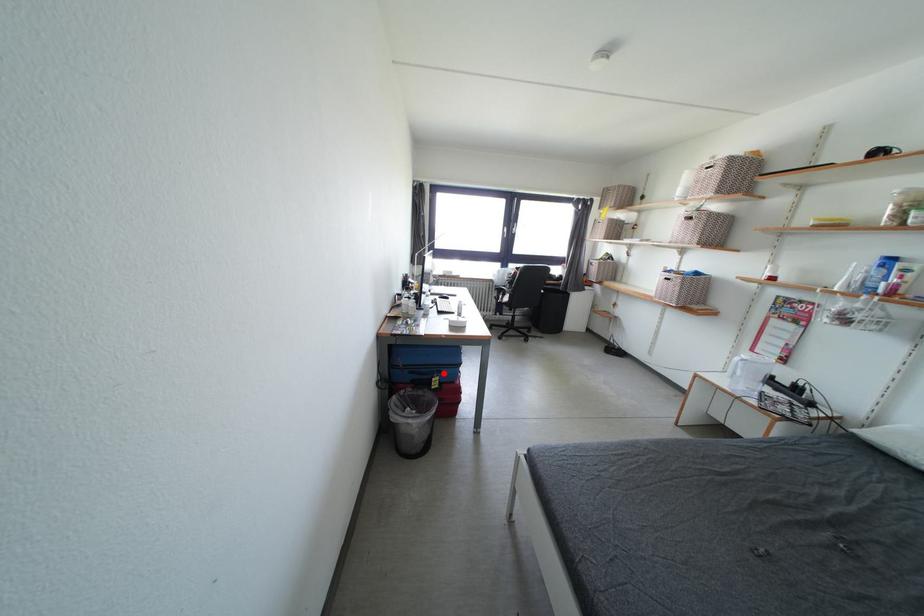
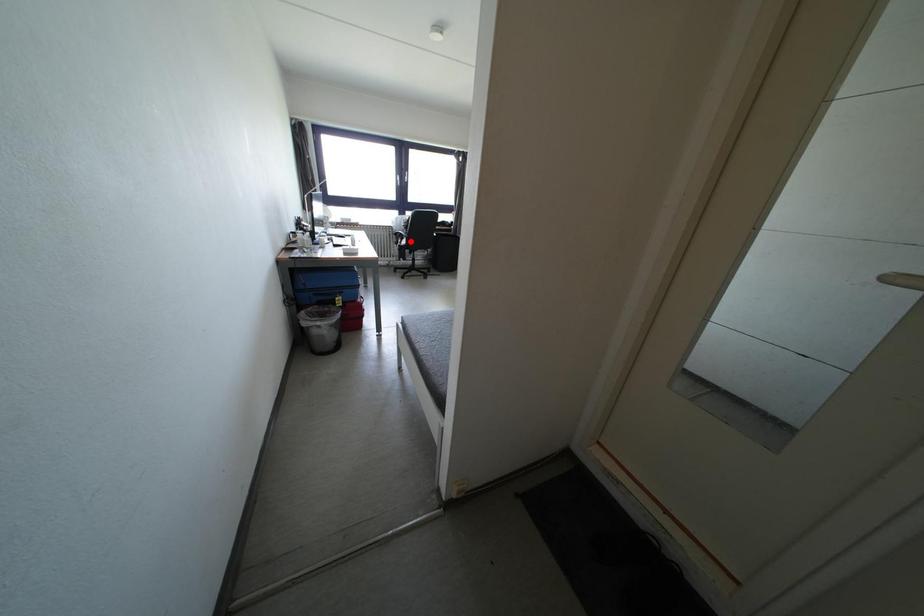
I am providing you with two images of the same scene from different viewpoints. A red point is marked on the first image and another point is marked on the second image. Does the point marked in image1 correspond to the same location as the one in image2?

No